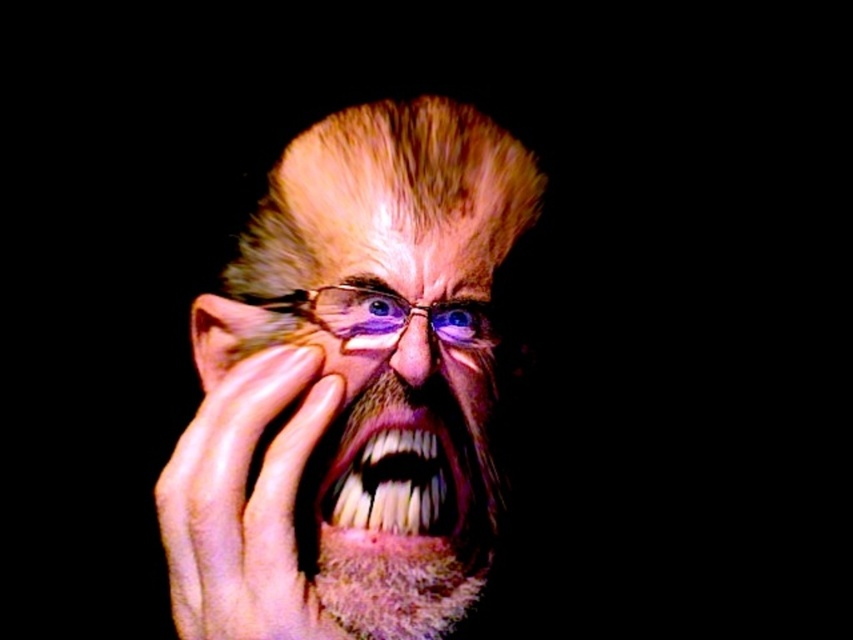
Which of these two, yellowish skin teeth at center or blue glassy eye at center, stands taller?

Standing taller between the two is yellowish skin teeth at center.

Is point (451, 464) more distant than point (372, 317)?

No.

This screenshot has width=853, height=640. I want to click on yellowish skin teeth at center, so click(x=405, y=474).

Between smooth skin hand at center and blue glassy eye at center, which one appears on the right side from the viewer's perspective?

blue glassy eye at center

Is point (199, 579) positioned before point (380, 305)?

Yes, it is.

The image size is (853, 640). In order to click on smooth skin hand at center in this screenshot , I will do `click(245, 502)`.

Which is behind, point (457, 339) or point (396, 301)?

Positioned behind is point (457, 339).

Is point (473, 308) positioned behind point (373, 310)?

Yes, it is.

Find the location of a particular element. This screenshot has width=853, height=640. blue glossy eye at center is located at coordinates (457, 321).